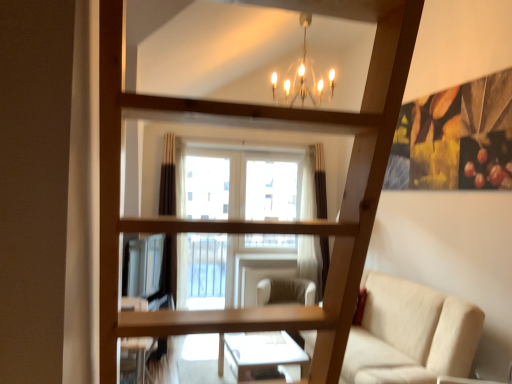
Question: Is point (407, 375) closer or farther from the camera than point (262, 291)?

Choices:
 (A) farther
 (B) closer

Answer: (B)

Question: In the image, is beige fabric couch at lower right positioned in front of or behind beige fabric swivel chair at center?

Choices:
 (A) front
 (B) behind

Answer: (A)

Question: Visually, is beige fabric couch at lower right positioned to the left or to the right of beige fabric swivel chair at center?

Choices:
 (A) left
 (B) right

Answer: (B)

Question: Is beige fabric swivel chair at center bigger or smaller than beige fabric couch at lower right?

Choices:
 (A) big
 (B) small

Answer: (B)

Question: Is point (314, 291) positioned closer to the camera than point (399, 316)?

Choices:
 (A) closer
 (B) farther

Answer: (B)

Question: In terms of width, does beige fabric swivel chair at center look wider or thinner when compared to beige fabric couch at lower right?

Choices:
 (A) thin
 (B) wide

Answer: (A)

Question: From the image's perspective, relative to beige fabric couch at lower right, is beige fabric swivel chair at center above or below?

Choices:
 (A) above
 (B) below

Answer: (B)